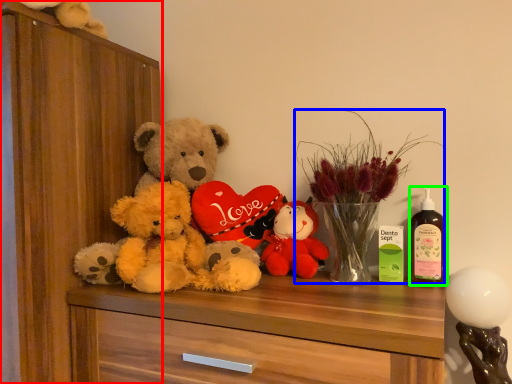
Question: Estimate the real-world distances between objects in this image. Which object is closer to dresser (highlighted by a red box), floral arrangement (highlighted by a blue box) or bottle (highlighted by a green box)?

Choices:
 (A) floral arrangement
 (B) bottle

Answer: (A)